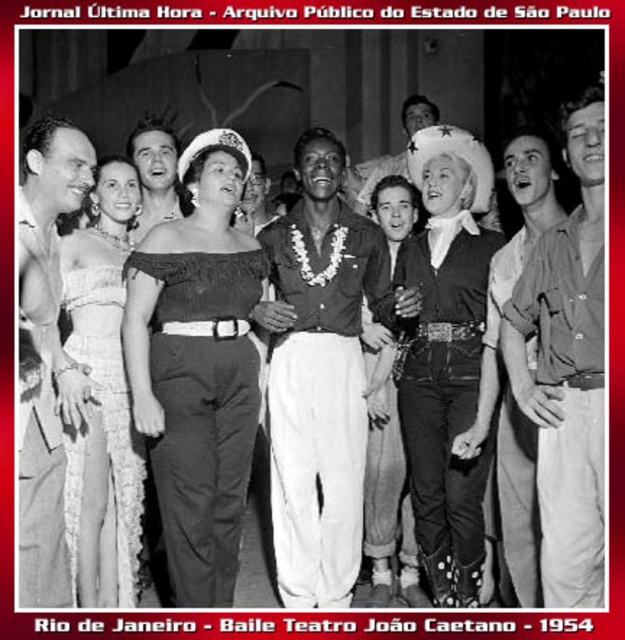
Does smooth brown leather jacket at center have a greater width compared to smooth leather jacket at center?

Correct, the width of smooth brown leather jacket at center exceeds that of smooth leather jacket at center.

Consider the image. Who is more forward, (356,413) or (368,205)?

Point (356,413) is in front.

Who is more forward, (x=292, y=602) or (x=431, y=118)?

Point (x=292, y=602)

Image resolution: width=625 pixels, height=640 pixels. Identify the location of smooth brown leather jacket at center. [x=318, y=376].

Which is more to the left, black satin dress at center or smooth skin shirt at left?

smooth skin shirt at left is more to the left.

Between black satin dress at center and smooth skin shirt at left, which one appears on the right side from the viewer's perspective?

Positioned to the right is black satin dress at center.

I want to click on black satin dress at center, so click(198, 365).

Between black satin dress at center and leather cowboy hat at center, which one has more height?

leather cowboy hat at center

Can you confirm if black satin dress at center is positioned to the left of leather cowboy hat at center?

Yes, black satin dress at center is to the left of leather cowboy hat at center.

Which is behind, point (176, 413) or point (475, 196)?

Point (475, 196)

You are a GUI agent. You are given a task and a screenshot of the screen. Output one action in this format:
    pyautogui.click(x=<x>, y=<y>)
    Task: Click on the black satin dress at center
    This screenshot has width=625, height=640.
    Given the screenshot: What is the action you would take?
    pyautogui.click(x=198, y=365)